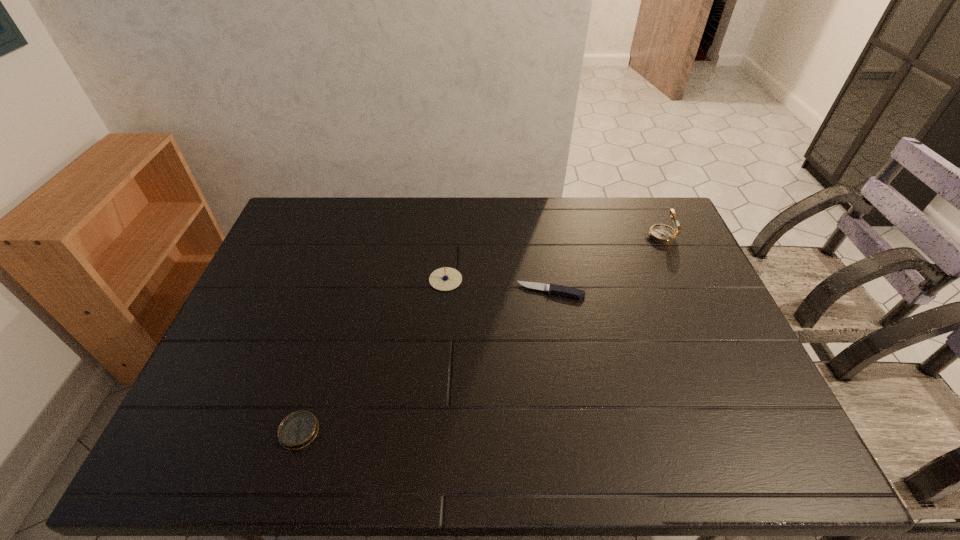
The width and height of the screenshot is (960, 540). I want to click on blank area in the image that satisfies the following two spatial constraints: 1. on the front side of the third shortest object; 2. on the left side of the steak knife, so click(444, 292).

At what (x,y) coordinates should I click in order to perform the action: click on vacant position in the image that satisfies the following two spatial constraints: 1. with the dial facing the farthest object; 2. on the front side of the second compass from left to right. Please return your answer as a coordinate pair (x, y). The height and width of the screenshot is (540, 960). Looking at the image, I should click on (680, 280).

Find the location of a particular element. The width and height of the screenshot is (960, 540). free location that satisfies the following two spatial constraints: 1. on the front side of the steak knife; 2. on the right side of the second compass from left to right is located at coordinates (444, 292).